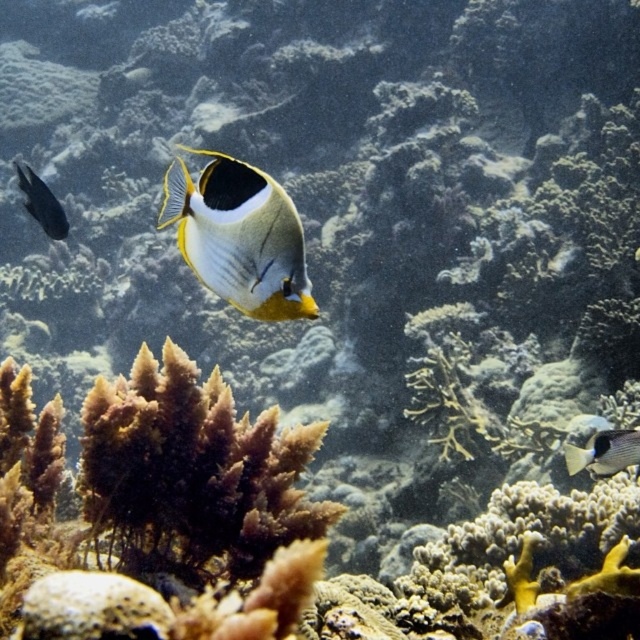
You are a marine biologist observing the underwater scene. You notice the yellow and white butterflyfish at center and the gray matte fish at right. Which fish would cast a larger shadow if sunlight were to shine directly from above?

The yellow and white butterflyfish at center has a larger size compared to the gray matte fish at right, so it would cast a larger shadow.

You are a marine biologist observing an underwater scene. You notice a specific point marked at coordinates point (588,444). Your underwater camera has a maximum focus range of 2 meters. Can you confirm if the camera can focus on this point?

The point (588,444) is 2.02 meters away from the camera. Since the camera has a maximum focus range of 2 meters, it cannot focus on this point as it is slightly beyond the range.